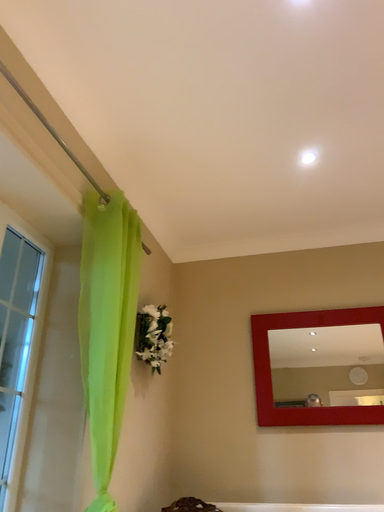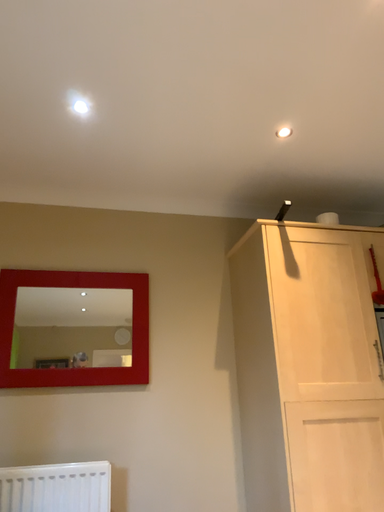
Question: How did the camera likely rotate when shooting the video?

Choices:
 (A) rotated left
 (B) rotated right

Answer: (B)